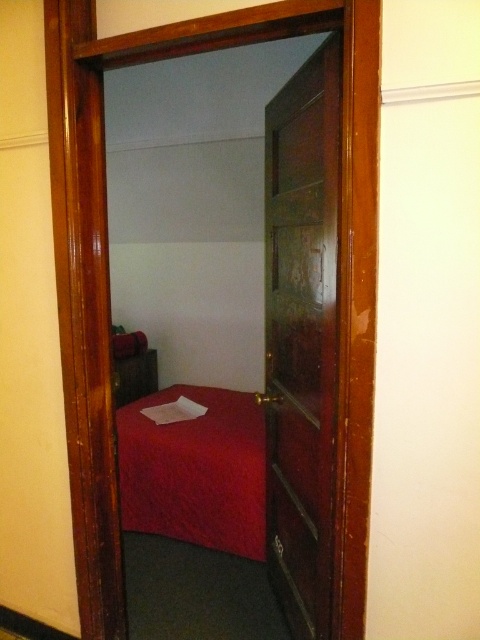
Question: From the image, what is the correct spatial relationship of mahogany wood door at center in relation to matte red bed at center?

Choices:
 (A) below
 (B) above

Answer: (B)

Question: Does mahogany wood door at center appear on the right side of matte red bed at center?

Choices:
 (A) yes
 (B) no

Answer: (A)

Question: Which of the following is the farthest from the observer?

Choices:
 (A) (287, 193)
 (B) (237, 532)

Answer: (B)

Question: Which object appears farthest from the camera in this image?

Choices:
 (A) matte red bed at center
 (B) mahogany wood door at center

Answer: (A)

Question: Is mahogany wood door at center to the left of matte red bed at center from the viewer's perspective?

Choices:
 (A) no
 (B) yes

Answer: (A)